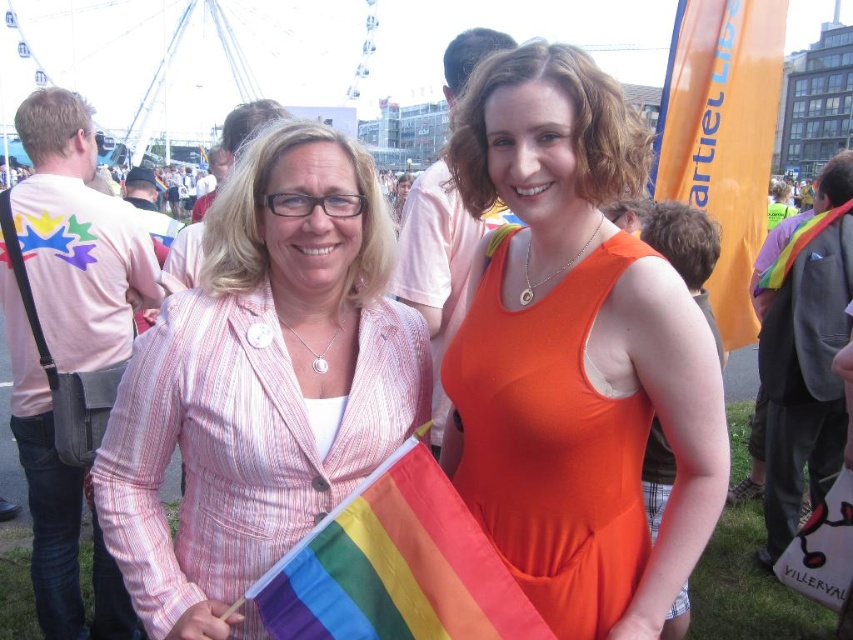
Question: Which object is positioned closest to the orange fabric dress at center?

Choices:
 (A) orange fabric flag at upper right
 (B) pink striped blazer at center

Answer: (B)

Question: Which point appears farthest from the camera in this image?

Choices:
 (A) (271, 573)
 (B) (218, 253)
 (C) (486, 83)
 (D) (747, 12)

Answer: (D)

Question: Estimate the real-world distances between objects in this image. Which object is farther from the orange fabric dress at center?

Choices:
 (A) pink striped blazer at center
 (B) orange fabric flag at upper right
 (C) rainbow fabric flag at center

Answer: (B)

Question: Does pink striped blazer at center have a lesser width compared to rainbow fabric flag at center?

Choices:
 (A) no
 (B) yes

Answer: (A)

Question: Can you confirm if orange fabric dress at center is smaller than pink striped blazer at center?

Choices:
 (A) no
 (B) yes

Answer: (A)

Question: Is orange fabric dress at center further to camera compared to orange fabric flag at upper right?

Choices:
 (A) yes
 (B) no

Answer: (B)